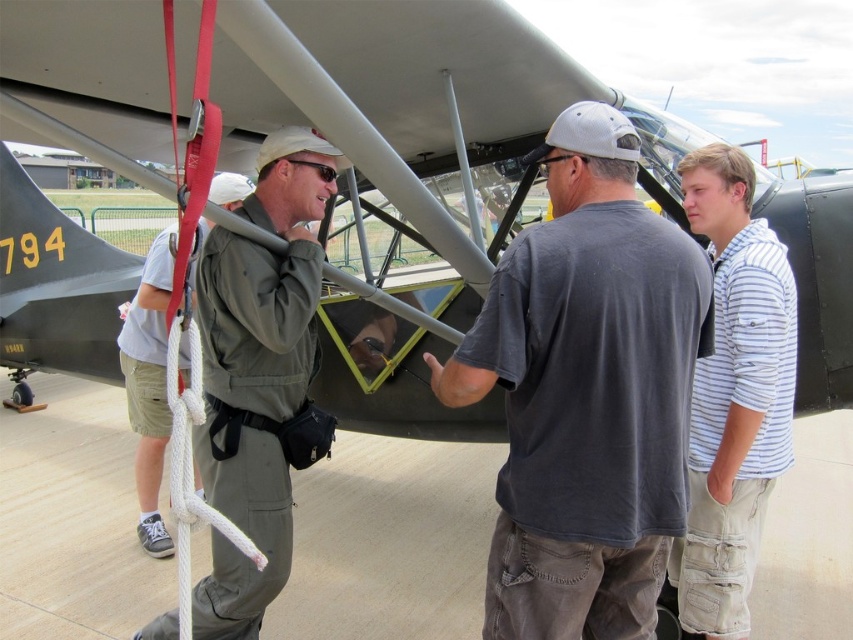
Is dark gray t-shirt at center to the right of green fabric pilot jacket at center from the viewer's perspective?

Yes, dark gray t-shirt at center is to the right of green fabric pilot jacket at center.

Image resolution: width=853 pixels, height=640 pixels. Find the location of `dark gray t-shirt at center`. dark gray t-shirt at center is located at coordinates (585, 392).

Identify the location of dark gray t-shirt at center. (585, 392).

Does green matte airplane at center have a greater width compared to white striped shirt at right?

Yes, green matte airplane at center is wider than white striped shirt at right.

Looking at this image, which is below, green matte airplane at center or white striped shirt at right?

white striped shirt at right

Between point (440, 193) and point (741, 209), which one is positioned in front?

Point (741, 209) is in front.

Locate an element on the screen. The width and height of the screenshot is (853, 640). green matte airplane at center is located at coordinates (410, 163).

Who is lower down, green matte airplane at center or green fabric pilot jacket at center?

Positioned lower is green fabric pilot jacket at center.

Who is more forward, (410, 301) or (248, 595)?

Point (248, 595)

The width and height of the screenshot is (853, 640). What are the coordinates of `green matte airplane at center` in the screenshot? It's located at (410, 163).